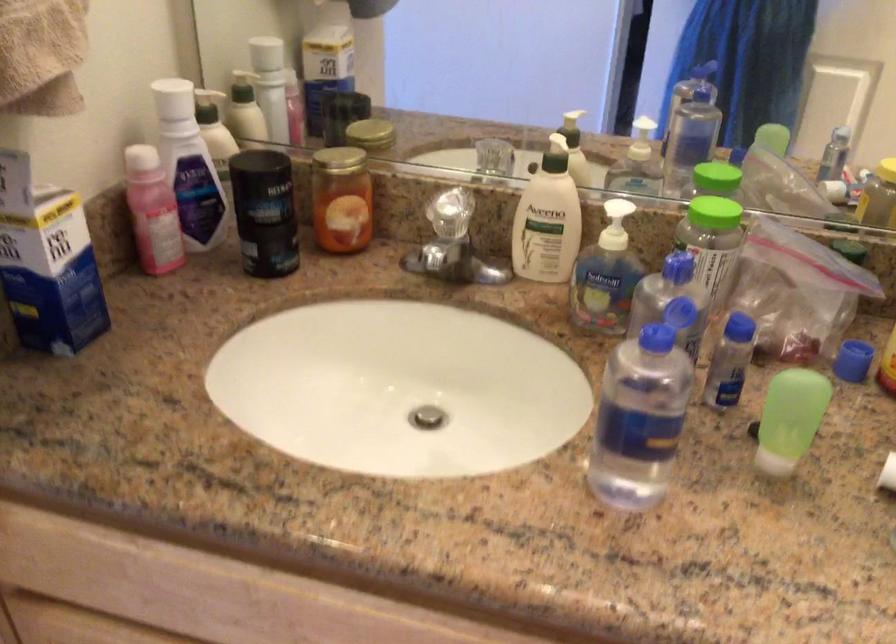
The width and height of the screenshot is (896, 644). In order to click on gold jar lid in this screenshot , I will do coord(336,160).